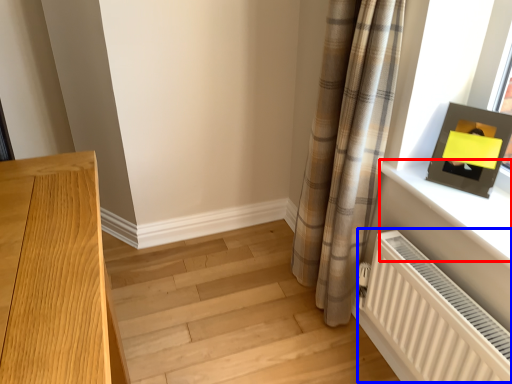
Question: Which object is closer to the camera taking this photo, window sill (highlighted by a red box) or radiator (highlighted by a blue box)?

Choices:
 (A) window sill
 (B) radiator

Answer: (B)